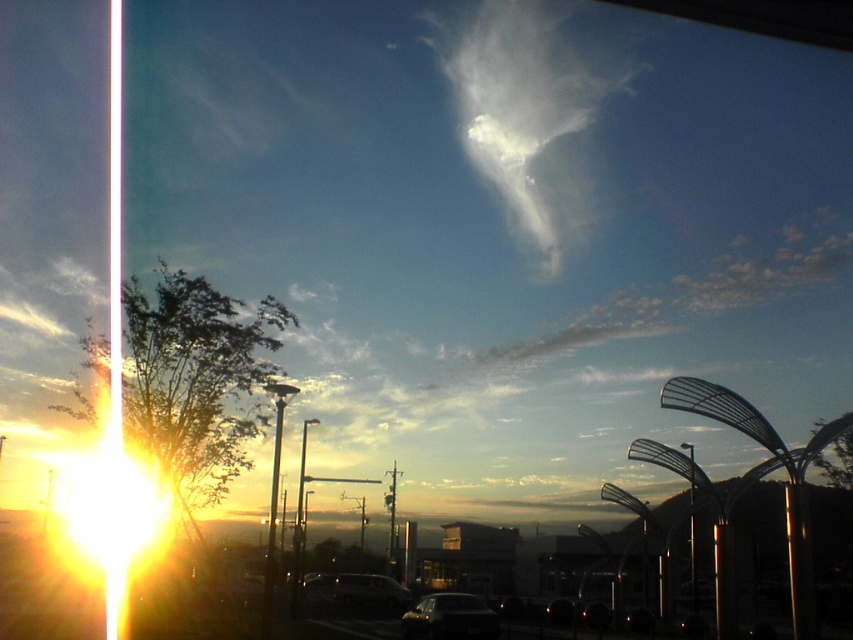
Which of these two, white fluffy cloud at upper center or matte silver van at center, stands taller?

white fluffy cloud at upper center is taller.

Locate an element on the screen. white fluffy cloud at upper center is located at coordinates (535, 102).

Which is in front, point (567, 100) or point (451, 618)?

Point (451, 618)

Does point (538, 99) come in front of point (469, 596)?

No, (538, 99) is further to viewer.

Is point (519, 198) more distant than point (469, 595)?

Yes, it is.

In order to click on white fluffy cloud at upper center in this screenshot , I will do `click(535, 102)`.

Which is above, dark gray metallic car at lower center or matte silver van at center?

dark gray metallic car at lower center

Is dark gray metallic car at lower center to the left of matte silver van at center from the viewer's perspective?

In fact, dark gray metallic car at lower center is to the right of matte silver van at center.

Is point (442, 620) less distant than point (376, 593)?

That is True.

The height and width of the screenshot is (640, 853). I want to click on dark gray metallic car at lower center, so click(450, 618).